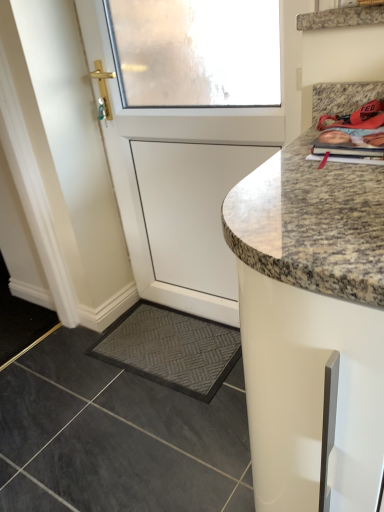
Where is `free space above granite at lower right (from a real-world perspective)`? The height and width of the screenshot is (512, 384). free space above granite at lower right (from a real-world perspective) is located at coordinates (133, 390).